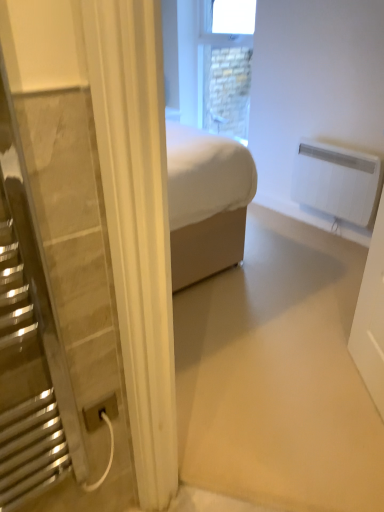
Question: Is stone textured window at upper center to the right of white plastic power plug at lower left from the viewer's perspective?

Choices:
 (A) yes
 (B) no

Answer: (A)

Question: Does stone textured window at upper center have a greater height compared to white plastic power plug at lower left?

Choices:
 (A) yes
 (B) no

Answer: (A)

Question: Considering the relative sizes of stone textured window at upper center and white plastic power plug at lower left in the image provided, is stone textured window at upper center shorter than white plastic power plug at lower left?

Choices:
 (A) no
 (B) yes

Answer: (A)

Question: Considering the relative sizes of stone textured window at upper center and white plastic power plug at lower left in the image provided, is stone textured window at upper center wider than white plastic power plug at lower left?

Choices:
 (A) no
 (B) yes

Answer: (B)

Question: From a real-world perspective, is stone textured window at upper center positioned over white plastic power plug at lower left based on gravity?

Choices:
 (A) no
 (B) yes

Answer: (B)

Question: From the image's perspective, is white plastic radiator at upper right positioned above or below white plastic power plug at lower left?

Choices:
 (A) below
 (B) above

Answer: (B)

Question: Choose the correct answer: Is white plastic radiator at upper right inside white plastic power plug at lower left or outside it?

Choices:
 (A) inside
 (B) outside

Answer: (B)

Question: Based on their positions, is white plastic radiator at upper right located to the left or right of white plastic power plug at lower left?

Choices:
 (A) right
 (B) left

Answer: (A)

Question: Looking at their shapes, would you say white plastic radiator at upper right is wider or thinner than white plastic power plug at lower left?

Choices:
 (A) wide
 (B) thin

Answer: (A)

Question: From the image's perspective, relative to white plastic power plug at lower left, is stone textured window at upper center above or below?

Choices:
 (A) below
 (B) above

Answer: (B)

Question: Based on their sizes in the image, would you say stone textured window at upper center is bigger or smaller than white plastic power plug at lower left?

Choices:
 (A) big
 (B) small

Answer: (A)

Question: Is stone textured window at upper center inside or outside of white plastic power plug at lower left?

Choices:
 (A) outside
 (B) inside

Answer: (A)

Question: From a real-world perspective, is stone textured window at upper center above or below white plastic power plug at lower left?

Choices:
 (A) below
 (B) above

Answer: (B)

Question: Looking at the image, does white plastic power plug at lower left seem bigger or smaller compared to white plastic radiator at upper right?

Choices:
 (A) small
 (B) big

Answer: (A)

Question: From a real-world perspective, is white plastic power plug at lower left physically located above or below white plastic radiator at upper right?

Choices:
 (A) above
 (B) below

Answer: (A)